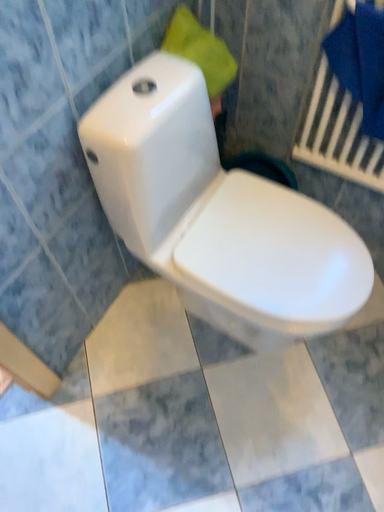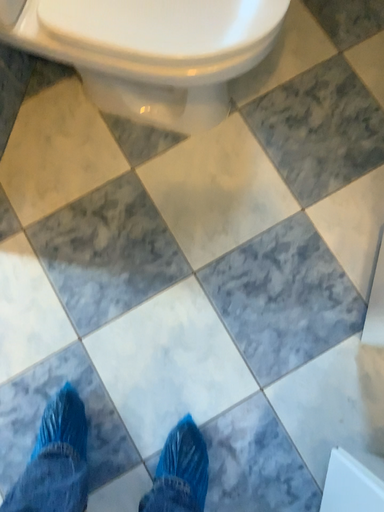
Question: Which way did the camera rotate in the video?

Choices:
 (A) rotated left
 (B) rotated right

Answer: (B)